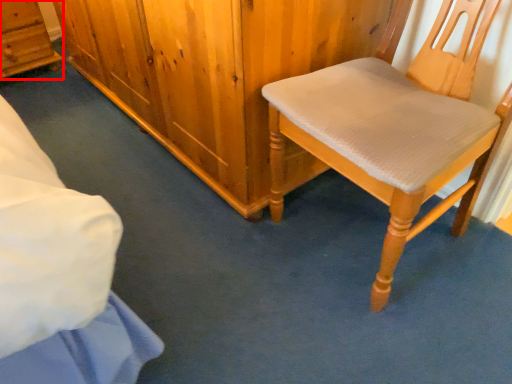
Question: In this image, where is cabinetry (annotated by the red box) located relative to chair?

Choices:
 (A) left
 (B) right

Answer: (A)